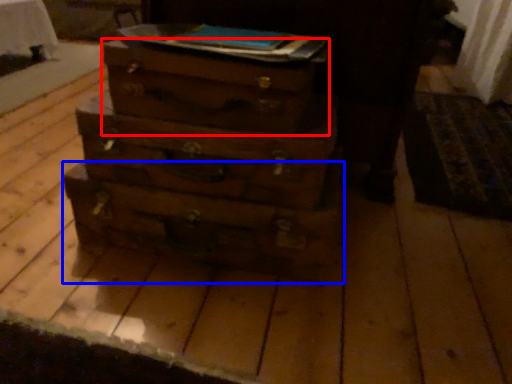
Question: Which object appears closest to the camera in this image, drawer (highlighted by a red box) or drawer (highlighted by a blue box)?

Choices:
 (A) drawer
 (B) drawer

Answer: (A)